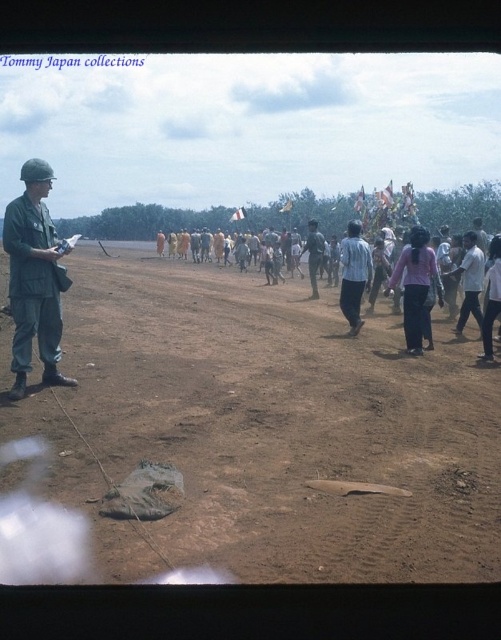
In the scene shown: You are observing a historical event from inside a vehicle or tent. You notice two people in uniforms in the midground. One is wearing a matte green uniform at left, and the other is in a dark green uniform at center. Which uniform is closer to you?

The matte green uniform at left is closer to you because it is positioned under the dark green uniform at center, indicating it is in a lower, nearer position.

You are a photographer inside a vehicle and want to capture both the brown sandy dirt at center and the dark green uniform at center in a single shot. Which object will occupy more space in your photo?

The brown sandy dirt at center is bigger than the dark green uniform at center, so it will occupy more space in the photo.